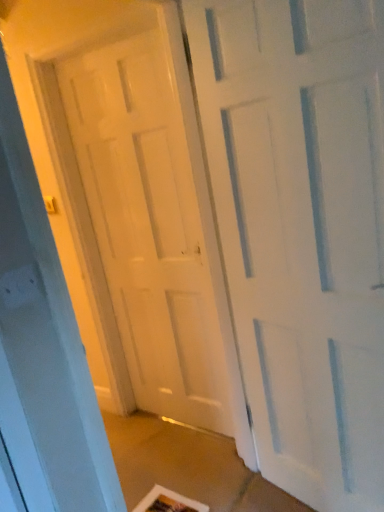
Question: Do you think white glossy door at center, the first door from the back, is within white matte door at center, which is the first door in front-to-back order, or outside of it?

Choices:
 (A) inside
 (B) outside

Answer: (B)

Question: Considering the positions of white glossy door at center, the first door from the back, and white matte door at center, which is counted as the second door, starting from the back, in the image, is white glossy door at center, the first door from the back, taller or shorter than white matte door at center, which is counted as the second door, starting from the back,?

Choices:
 (A) short
 (B) tall

Answer: (B)

Question: From the image's perspective, relative to white matte door at center, which is the first door in front-to-back order, is white glossy door at center, positioned as the 2th door in front-to-back order, above or below?

Choices:
 (A) above
 (B) below

Answer: (A)

Question: From the image's perspective, relative to white glossy door at center, the first door from the back, is white matte door at center, which is the first door in front-to-back order, above or below?

Choices:
 (A) below
 (B) above

Answer: (A)

Question: Is point (281, 419) positioned closer to the camera than point (107, 91)?

Choices:
 (A) farther
 (B) closer

Answer: (B)

Question: From their relative heights in the image, would you say white matte door at center, which is the first door in front-to-back order, is taller or shorter than white glossy door at center, positioned as the 2th door in front-to-back order?

Choices:
 (A) short
 (B) tall

Answer: (A)

Question: From a real-world perspective, relative to white glossy door at center, positioned as the 2th door in front-to-back order, is white matte door at center, which is the first door in front-to-back order, vertically above or below?

Choices:
 (A) below
 (B) above

Answer: (A)